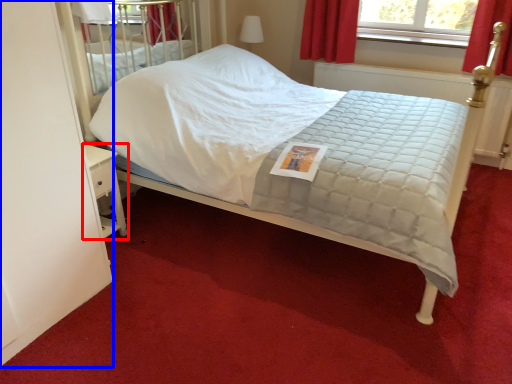
Question: Which point is further to the camera, nightstand (highlighted by a red box) or screen door (highlighted by a blue box)?

Choices:
 (A) nightstand
 (B) screen door

Answer: (A)